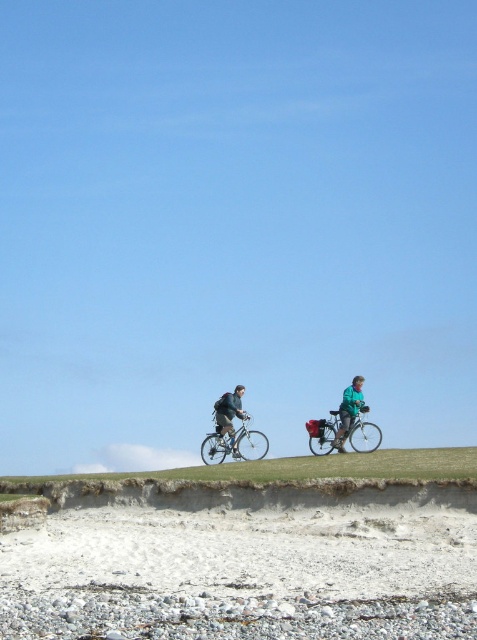
Can you confirm if shiny silver bicycle at center is taller than matte black bicycle at center?

No.

Which is above, shiny silver bicycle at center or matte black bicycle at center?

matte black bicycle at center is higher up.

At what (x,y) coordinates should I click in order to perform the action: click on shiny silver bicycle at center. Please return your answer as a coordinate pair (x, y). This screenshot has width=477, height=640. Looking at the image, I should click on (234, 444).

This screenshot has width=477, height=640. Identify the location of shiny silver bicycle at center. (234, 444).

Is green grassy hill at center behind teal fabric jacket at center?

No, green grassy hill at center is in front of teal fabric jacket at center.

Can you confirm if green grassy hill at center is taller than teal fabric jacket at center?

Indeed, green grassy hill at center has a greater height compared to teal fabric jacket at center.

Who is more distant from viewer, (195, 474) or (348, 404)?

The point (348, 404) is behind.

This screenshot has width=477, height=640. I want to click on green grassy hill at center, so click(311, 467).

Between metallic silver bicycle at center and teal fabric jacket at center, which one is positioned higher?

teal fabric jacket at center is higher up.

Who is taller, metallic silver bicycle at center or teal fabric jacket at center?

Standing taller between the two is teal fabric jacket at center.

Which is behind, point (318, 428) or point (355, 397)?

The point (318, 428) is behind.

In order to click on metallic silver bicycle at center in this screenshot , I will do `click(362, 433)`.